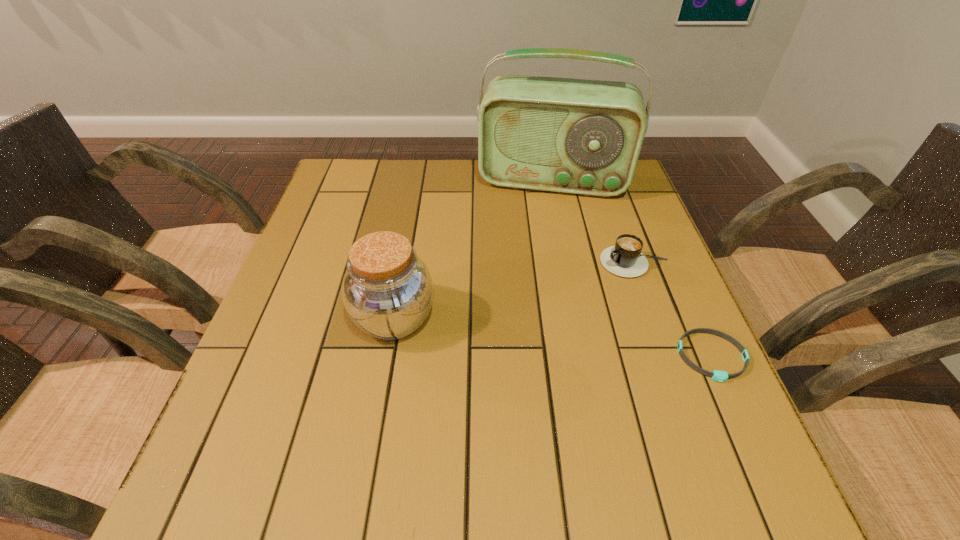
Locate an element on the screen. free space on the desktop that is between the third shortest object and the shortest object and is positioned with the handle on the side of the cappuccino is located at coordinates (505, 332).

Image resolution: width=960 pixels, height=540 pixels. Find the location of `vacant space on the desktop that is between the jar and the shortest object and is positioned on the front panel of the radio receiver`. vacant space on the desktop that is between the jar and the shortest object and is positioned on the front panel of the radio receiver is located at coordinates (536, 335).